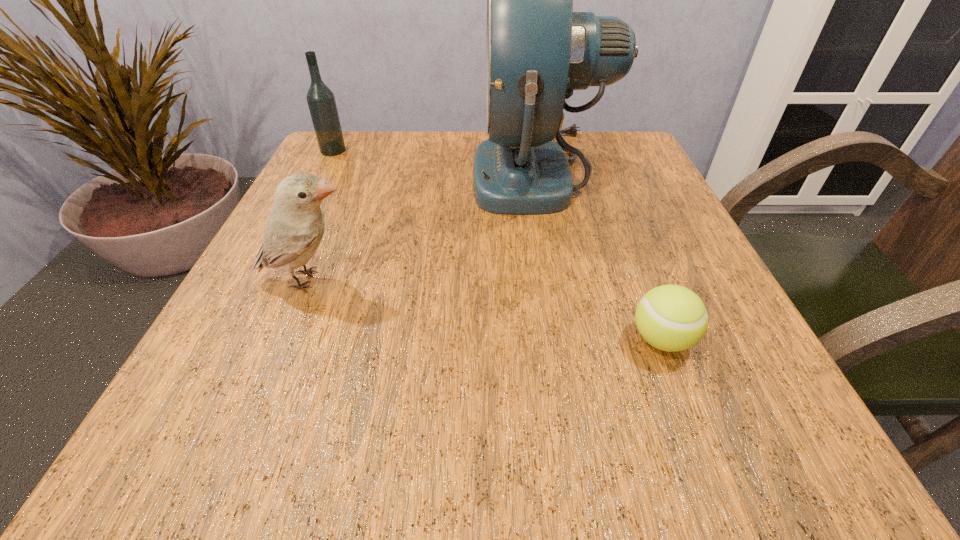
The image size is (960, 540). I want to click on vacant point at the near edge, so click(x=405, y=417).

This screenshot has height=540, width=960. Identify the location of free space at the left edge. 348,212.

In the image, there is a desktop. Identify the location of vacant space at the right edge. The image size is (960, 540). pyautogui.click(x=593, y=191).

In the image, there is a desktop. What are the coordinates of `vacant space at the near left corner` in the screenshot? It's located at (170, 460).

Locate an element on the screen. free space at the near right corner of the desktop is located at coordinates (780, 449).

At what (x,y) coordinates should I click in order to perform the action: click on unoccupied position between the vodka and the tennis ball. Please return your answer as a coordinate pair (x, y). This screenshot has height=540, width=960. Looking at the image, I should click on pos(497,245).

Find the location of a particular element. free area in between the fan and the tennis ball is located at coordinates (601, 256).

Where is `empty space between the shortest object and the third farthest object`? empty space between the shortest object and the third farthest object is located at coordinates (485, 310).

Image resolution: width=960 pixels, height=540 pixels. What are the coordinates of `vacant space that's between the nearest object and the tallest object` in the screenshot? It's located at (601, 256).

This screenshot has height=540, width=960. I want to click on vacant space that is in between the tallest object and the vodka, so tap(437, 162).